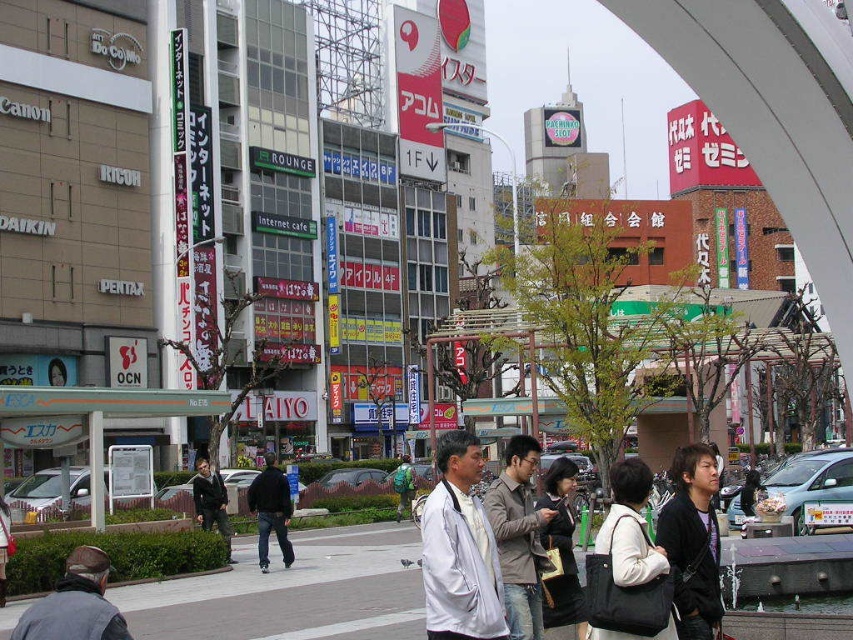
Is white matte jacket at center to the right of dark brown leather jacket at center from the viewer's perspective?

No, white matte jacket at center is not to the right of dark brown leather jacket at center.

Between point (451, 444) and point (712, 481), which one is positioned behind?

The point (451, 444) is behind.

You are a GUI agent. You are given a task and a screenshot of the screen. Output one action in this format:
    pyautogui.click(x=<x>, y=<y>)
    Task: Click on the white matte jacket at center
    The image size is (853, 640).
    Given the screenshot: What is the action you would take?
    [459, 548]

Based on the photo, can you confirm if dark brown leather jacket at center is positioned above gray fabric jacket at lower left?

Correct, dark brown leather jacket at center is located above gray fabric jacket at lower left.

Which is in front, point (683, 484) or point (70, 612)?

Point (70, 612) is more forward.

Identify the location of dark brown leather jacket at center. (693, 541).

Who is taller, light brown leather jacket at center or black fabric bag at center?

Standing taller between the two is light brown leather jacket at center.

Can you confirm if light brown leather jacket at center is thinner than black fabric bag at center?

No, light brown leather jacket at center is not thinner than black fabric bag at center.

Is point (531, 568) positioned after point (635, 522)?

That is True.

This screenshot has height=640, width=853. I want to click on light brown leather jacket at center, so click(x=518, y=536).